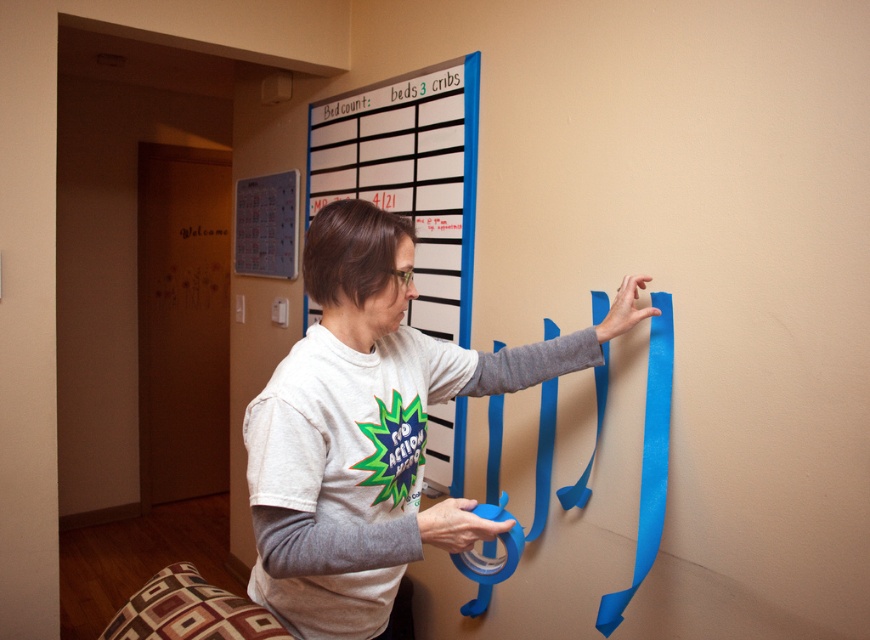
Is matte blue tape at center behind blue matte tape at center?

No, matte blue tape at center is closer to the viewer.

Is matte blue tape at center shorter than blue matte tape at center?

Correct, matte blue tape at center is not as tall as blue matte tape at center.

This screenshot has height=640, width=870. Identify the location of matte blue tape at center. (371, 428).

Can you confirm if blue plastic board at upper center is taller than blue matte tape at center?

Indeed, blue plastic board at upper center has a greater height compared to blue matte tape at center.

Can you confirm if blue plastic board at upper center is positioned to the left of blue matte tape at center?

Correct, you'll find blue plastic board at upper center to the left of blue matte tape at center.

Locate an element on the screen. blue plastic board at upper center is located at coordinates (410, 173).

Locate an element on the screen. The width and height of the screenshot is (870, 640). blue plastic board at upper center is located at coordinates (410, 173).

Between matte blue tape at center and blue plastic board at upper center, which one appears on the right side from the viewer's perspective?

From the viewer's perspective, matte blue tape at center appears more on the right side.

Is matte blue tape at center to the left of blue plastic board at upper center from the viewer's perspective?

No, matte blue tape at center is not to the left of blue plastic board at upper center.

Is point (375, 225) more distant than point (464, 125)?

That is False.

The height and width of the screenshot is (640, 870). Identify the location of matte blue tape at center. (371, 428).